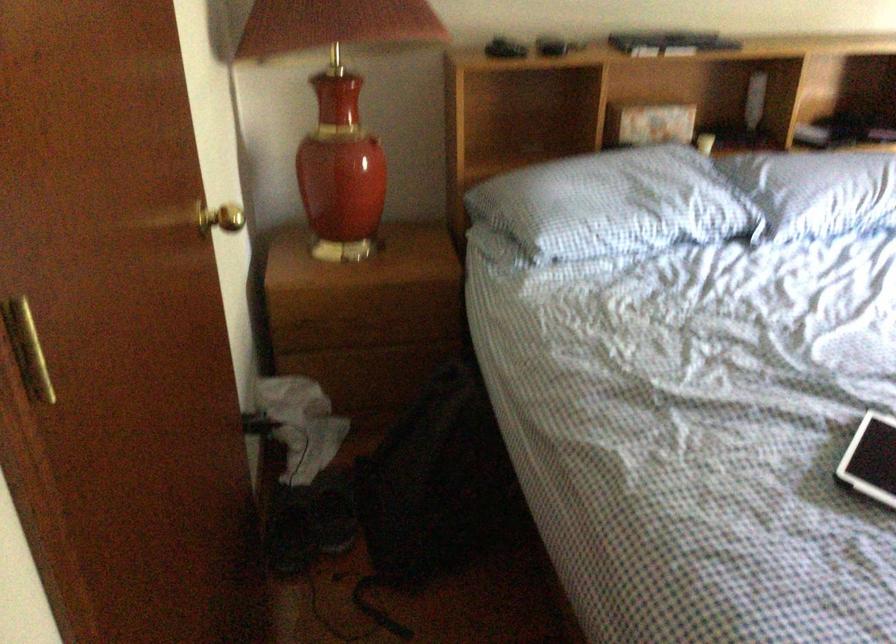
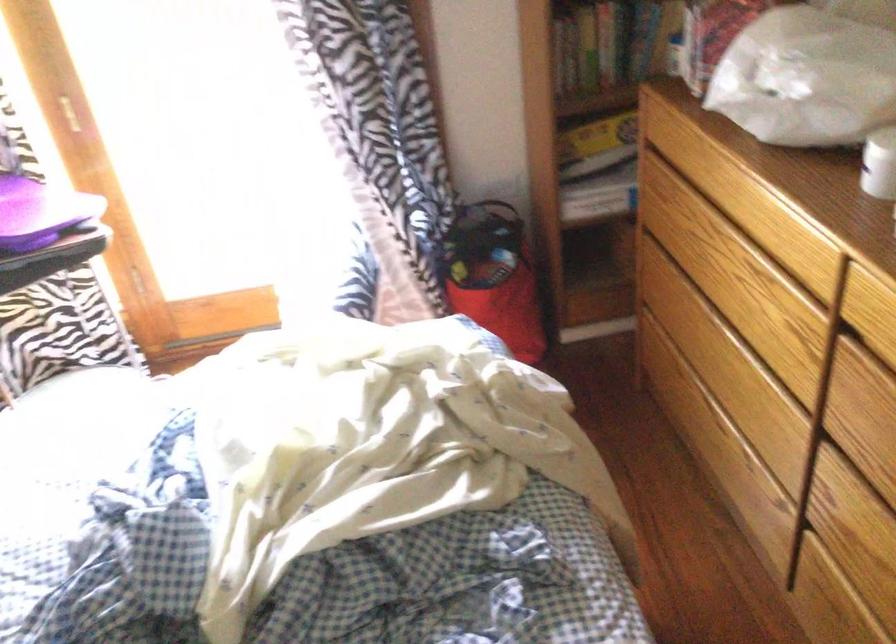
How did the camera likely rotate?

The rotation direction of the camera is right-down.